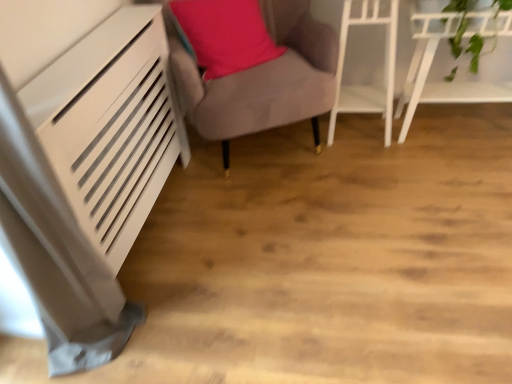
Find the location of a particular element. vacant space positioned to the left of white glossy shelf at upper right, acting as the second furniture starting from the right is located at coordinates (304, 144).